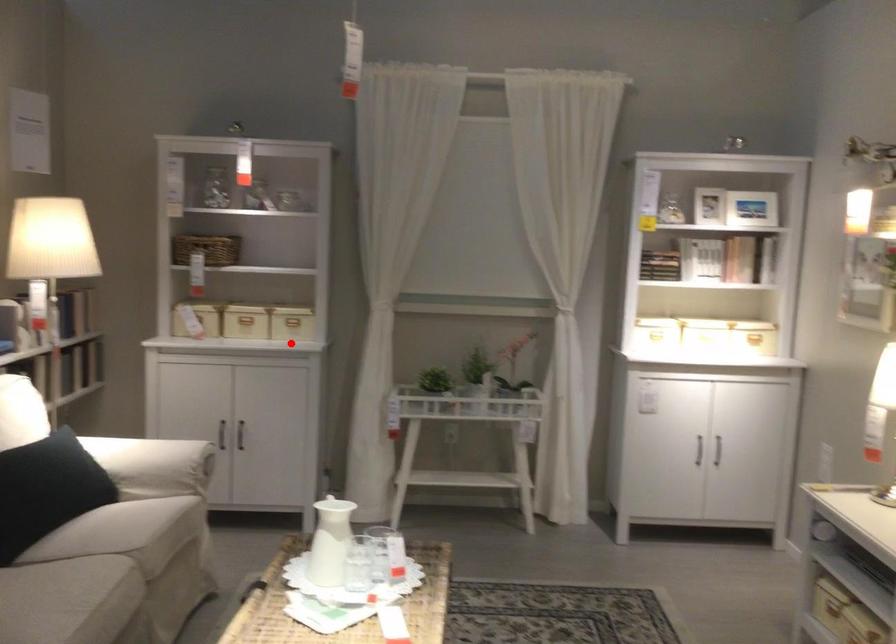
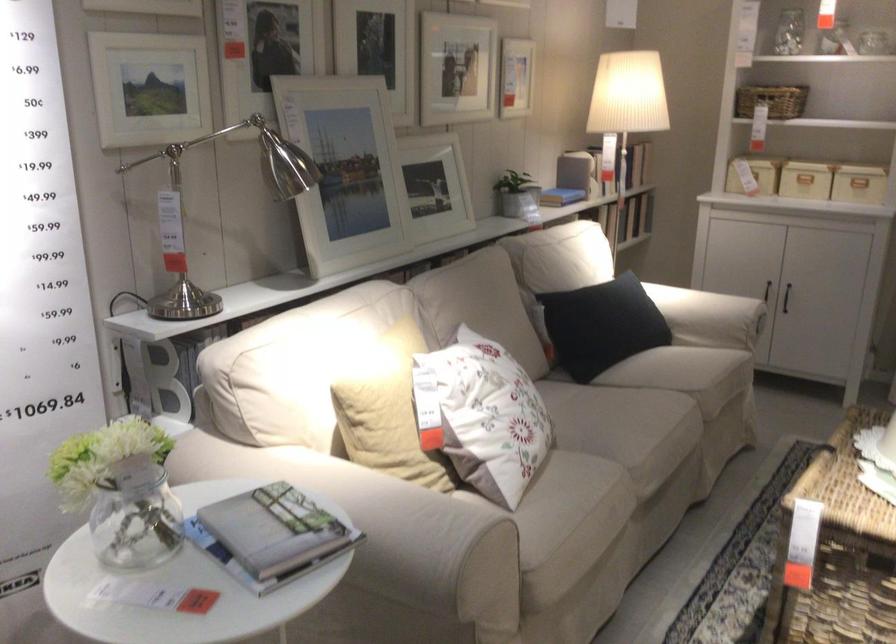
Question: I am providing you with two images of the same scene from different viewpoints. Image1 has a red point marked. In image2, the corresponding 3D location appears at what relative position? Reply with the corresponding letter.

Choices:
 (A) Closer
 (B) Farther

Answer: (A)